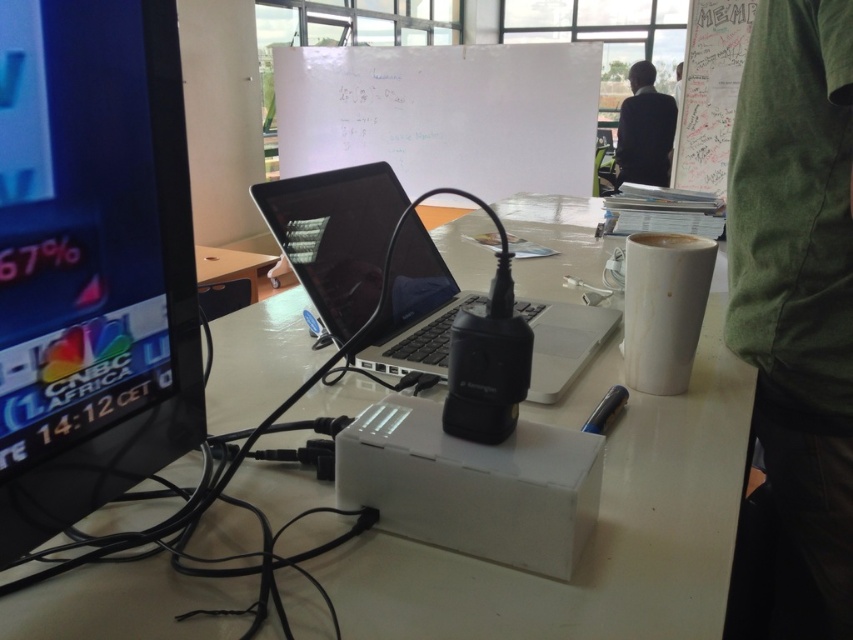
You are organizing the desk items and need to place a new item between the matte black monitor at left and the white matte cup at upper right. Based on their positions, where should you position the new item?

The new item should be placed between the matte black monitor at left and the white matte cup at upper right. Since the matte black monitor at left is below the white matte cup at upper right, the new item should be positioned above the matte black monitor at left and below the white matte cup at upper right to maintain spatial order.

You are organizing a presentation and need to place a large poster on the desk. Given the current setup with the white plastic table at center and the sleek black laptop at center, which object should you move to make space?

The sleek black laptop at center should be moved because the white plastic table at center is larger and has more space available.

You are organizing a presentation and need to place a laptop bag on the desk. The laptop bag is wider than the black fabric jacket at upper right. Will it fit to the left of the matte black monitor at left?

The matte black monitor at left is to the left of the black fabric jacket at upper right, so placing the laptop bag wider than the black fabric jacket at upper right to the left of the matte black monitor at left may not be possible since the space available might be constrained by the monitor and other desk items.